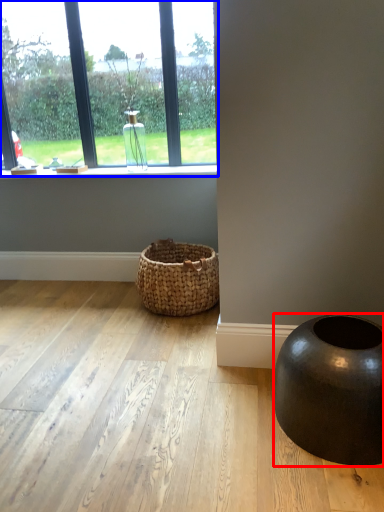
Question: Which point is further to the camera, oval (highlighted by a red box) or window (highlighted by a blue box)?

Choices:
 (A) oval
 (B) window

Answer: (B)